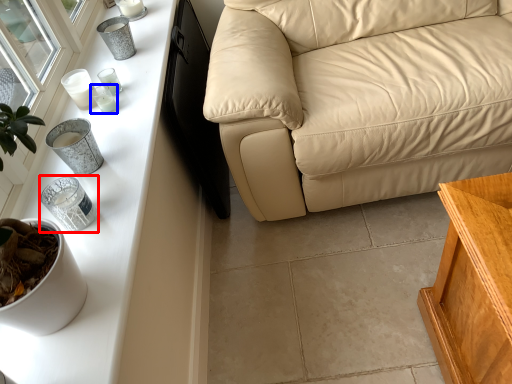
Question: Which object is further to the camera taking this photo, candle holder (highlighted by a red box) or candle holder (highlighted by a blue box)?

Choices:
 (A) candle holder
 (B) candle holder

Answer: (B)